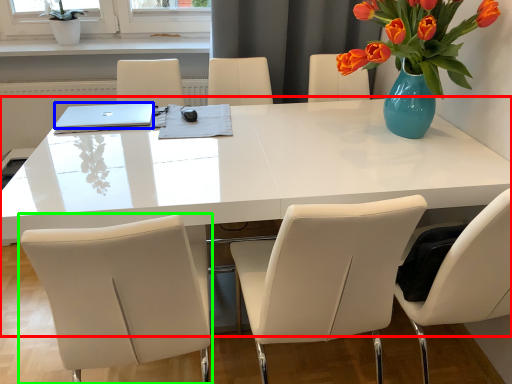
Question: Which object is positioned closest to table (highlighted by a red box)? Select from laptop (highlighted by a blue box) and chair (highlighted by a green box).

Choices:
 (A) laptop
 (B) chair

Answer: (B)